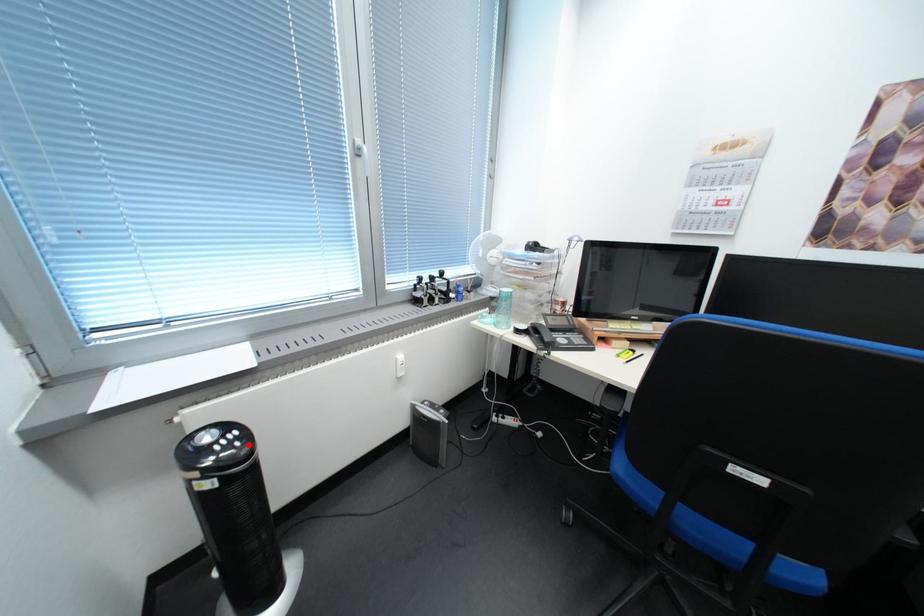
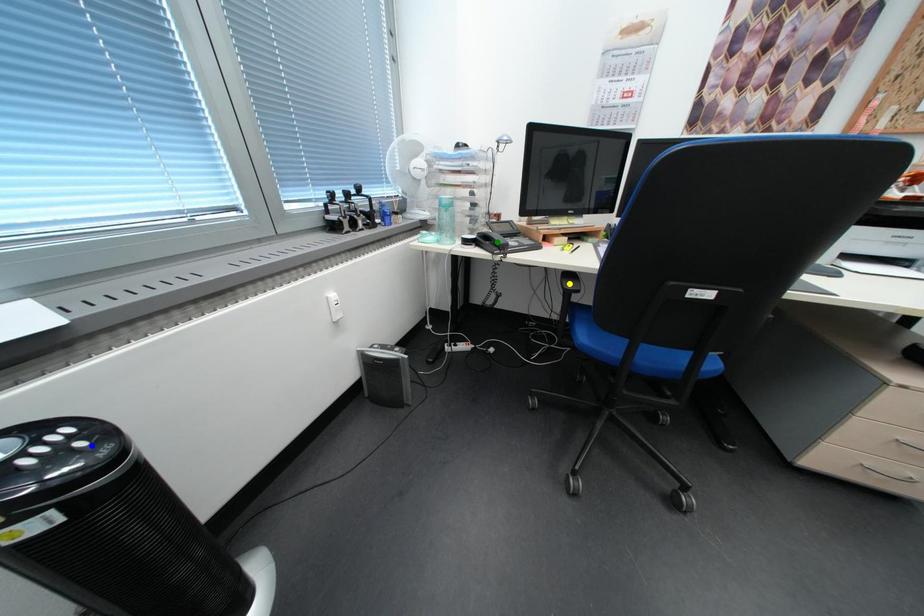
Question: I am providing you with two images of the same scene from different viewpoints. A red point is marked on the first image. You are given multiple points on the second image. In image 2, which mark is for the same physical point as the one in image 1?

Choices:
 (A) green point
 (B) yellow point
 (C) blue point

Answer: (C)